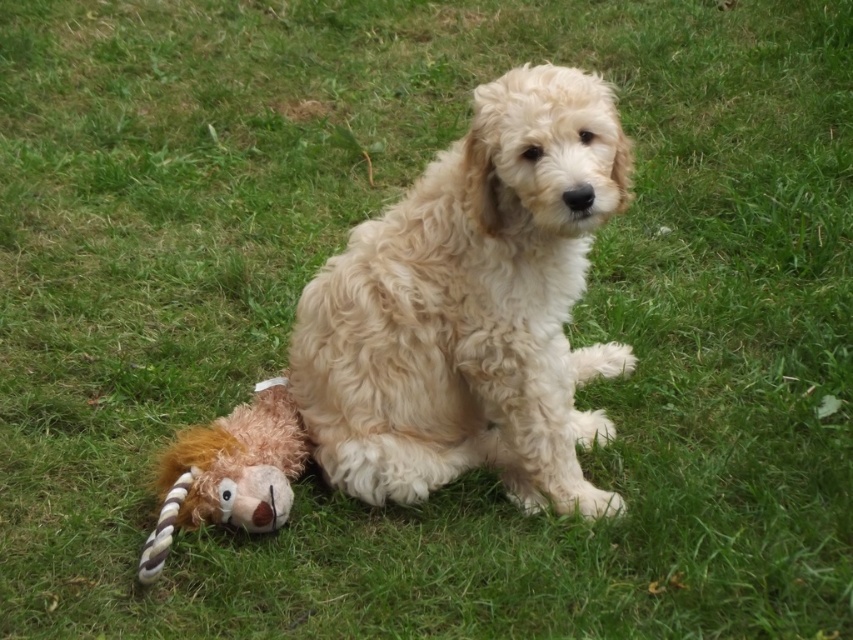
Does point (357, 362) come in front of point (299, 435)?

Yes, it is.

Is point (503, 417) more distant than point (177, 436)?

No, (503, 417) is closer to viewer.

Is point (550, 435) behind point (254, 508)?

Yes, it is behind point (254, 508).

Where is `fluffy white dog at center`? The image size is (853, 640). fluffy white dog at center is located at coordinates (473, 308).